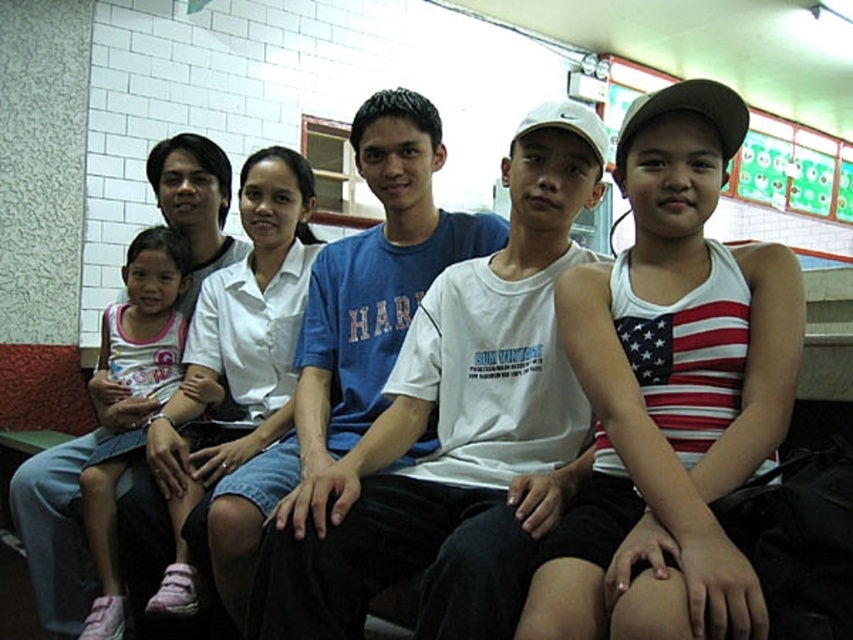
Question: In this image, where is white cotton shirt at center located relative to pink fabric dress at left?

Choices:
 (A) below
 (B) above

Answer: (B)

Question: Is blue cotton t-shirt at center thinner than pink fabric dress at left?

Choices:
 (A) no
 (B) yes

Answer: (A)

Question: Which object appears closest to the camera in this image?

Choices:
 (A) pink fabric dress at left
 (B) blue cotton t-shirt at center
 (C) white cotton tank top at center

Answer: (C)

Question: Which object is farther from the camera taking this photo?

Choices:
 (A) blue cotton t-shirt at center
 (B) pink fabric dress at left
 (C) white cotton tank top at center

Answer: (B)

Question: Can you confirm if white cotton tank top at center is smaller than blue cotton t-shirt at center?

Choices:
 (A) yes
 (B) no

Answer: (A)

Question: Which object is the farthest from the pink fabric dress at left?

Choices:
 (A) blue cotton t-shirt at center
 (B) white cotton shirt at center
 (C) white cotton tank top at center

Answer: (C)